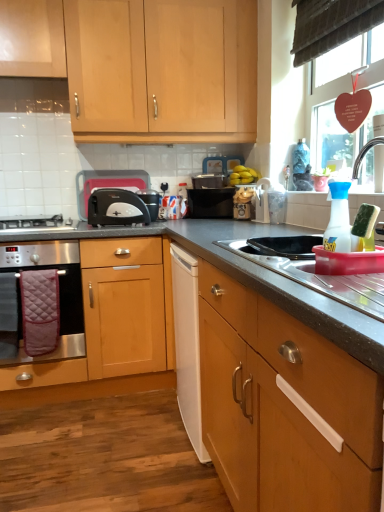
Question: Is silver metallic faucet at upper right with yellow matte bananas at upper center?

Choices:
 (A) yes
 (B) no

Answer: (B)

Question: From a real-world perspective, is silver metallic faucet at upper right positioned under yellow matte bananas at upper center based on gravity?

Choices:
 (A) no
 (B) yes

Answer: (A)

Question: Is silver metallic faucet at upper right turned away from yellow matte bananas at upper center?

Choices:
 (A) yes
 (B) no

Answer: (B)

Question: Does silver metallic faucet at upper right have a lesser height compared to yellow matte bananas at upper center?

Choices:
 (A) yes
 (B) no

Answer: (B)

Question: Is silver metallic faucet at upper right at the right side of yellow matte bananas at upper center?

Choices:
 (A) no
 (B) yes

Answer: (B)

Question: Is white plastic container at upper center, arranged as the third appliance when viewed from the back, inside the boundaries of matte plastic jar at center, arranged as the 2th appliance when viewed from the back, or outside?

Choices:
 (A) inside
 (B) outside

Answer: (B)

Question: From the image's perspective, relative to matte plastic jar at center, arranged as the 2th appliance when viewed from the back, is white plastic container at upper center, arranged as the third appliance when viewed from the back, above or below?

Choices:
 (A) above
 (B) below

Answer: (B)

Question: From a real-world perspective, is white plastic container at upper center, the 3th appliance positioned from the front, positioned above or below matte plastic jar at center, arranged as the 2th appliance when viewed from the back?

Choices:
 (A) below
 (B) above

Answer: (B)

Question: Based on their positions, is white plastic container at upper center, arranged as the third appliance when viewed from the back, located to the left or right of matte plastic jar at center, marked as the fourth appliance in a front-to-back arrangement?

Choices:
 (A) left
 (B) right

Answer: (B)

Question: From the image's perspective, is black matte microwave at center, which ranks as the 1th appliance in back-to-front order, positioned above or below pink quilted oven mitt at lower left?

Choices:
 (A) below
 (B) above

Answer: (B)

Question: From a real-world perspective, is black matte microwave at center, which ranks as the 1th appliance in back-to-front order, above or below pink quilted oven mitt at lower left?

Choices:
 (A) above
 (B) below

Answer: (A)

Question: Would you say black matte microwave at center, which ranks as the 1th appliance in back-to-front order, is to the left or to the right of pink quilted oven mitt at lower left in the picture?

Choices:
 (A) left
 (B) right

Answer: (B)

Question: Is point (x=203, y=197) positioned closer to the camera than point (x=23, y=274)?

Choices:
 (A) closer
 (B) farther

Answer: (B)

Question: Considering the relative positions of stainless steel oven at lower left and white plastic toaster at center-left in the image provided, is stainless steel oven at lower left to the left or to the right of white plastic toaster at center-left?

Choices:
 (A) right
 (B) left

Answer: (B)

Question: Is stainless steel oven at lower left in front of or behind white plastic toaster at center-left in the image?

Choices:
 (A) front
 (B) behind

Answer: (A)